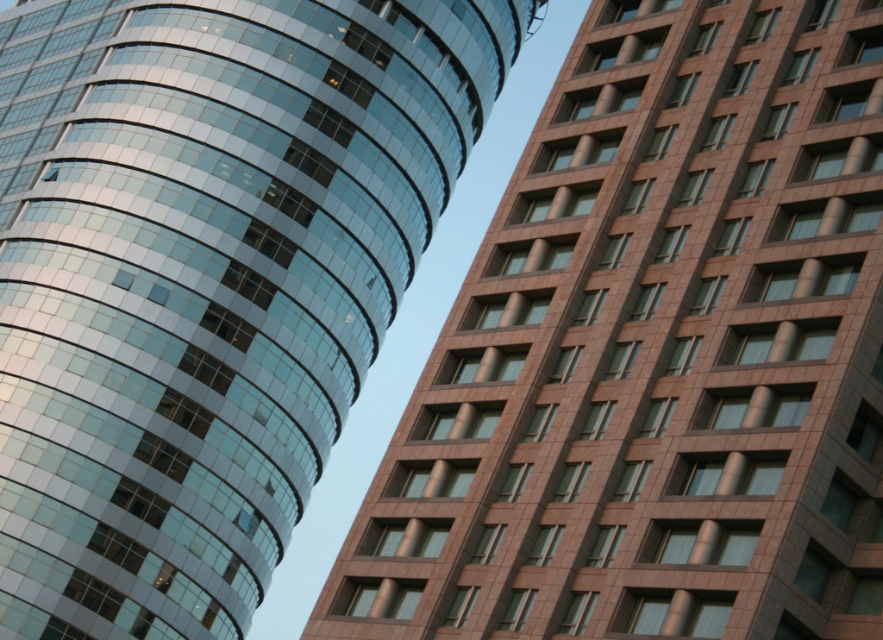
Question: Which of the following is the closest to the observer?

Choices:
 (A) (431, 484)
 (B) (159, 348)

Answer: (A)

Question: Which point appears closest to the camera in this image?

Choices:
 (A) pos(282,468)
 (B) pos(676,499)

Answer: (B)

Question: Which object appears farthest from the camera in this image?

Choices:
 (A) glassy reflective tower at left
 (B) shiny glass building at upper left

Answer: (B)

Question: From the image, what is the correct spatial relationship of glassy reflective tower at left in relation to shiny glass building at upper left?

Choices:
 (A) below
 (B) above

Answer: (A)

Question: Can you confirm if glassy reflective tower at left is positioned below shiny glass building at upper left?

Choices:
 (A) yes
 (B) no

Answer: (A)

Question: Is glassy reflective tower at left to the right of shiny glass building at upper left from the viewer's perspective?

Choices:
 (A) no
 (B) yes

Answer: (B)